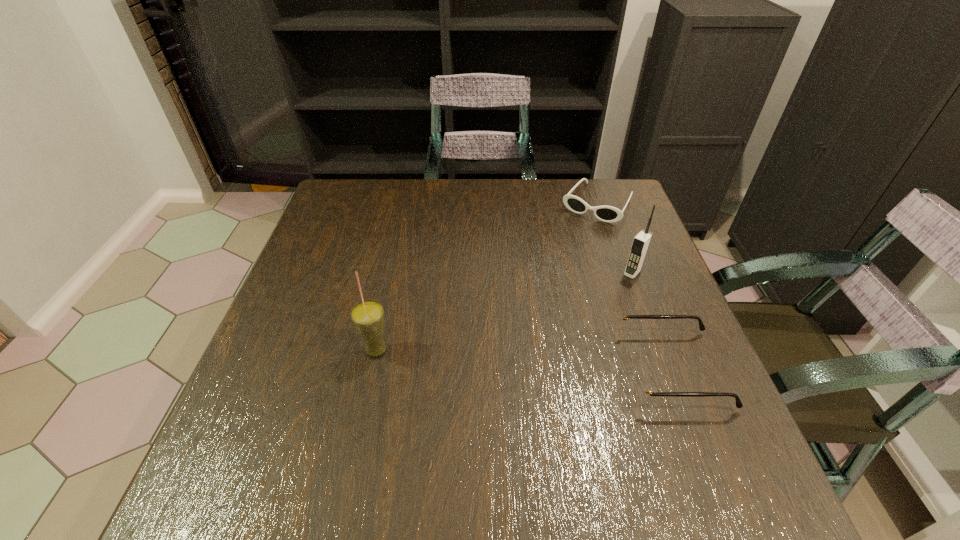
Find the location of a particular element. This screenshot has height=540, width=960. object situated at the near right corner is located at coordinates (640, 385).

Find the location of `vacant region at the far edge`. vacant region at the far edge is located at coordinates (448, 199).

Where is `free space at the near edge`? free space at the near edge is located at coordinates (504, 434).

Identify the location of free spot at the left edge of the desktop. This screenshot has width=960, height=540. (292, 322).

Where is `vacant region at the right edge of the desktop`? This screenshot has height=540, width=960. vacant region at the right edge of the desktop is located at coordinates (599, 258).

In the image, there is a desktop. Identify the location of vacant space at the far left corner. (364, 212).

In the image, there is a desktop. Find the location of `free space at the near left corner`. free space at the near left corner is located at coordinates 314,435.

Where is `blank area at the far right corner`? The width and height of the screenshot is (960, 540). blank area at the far right corner is located at coordinates (621, 195).

This screenshot has width=960, height=540. Identify the location of vacant area at the near right corner of the desktop. (654, 439).

The height and width of the screenshot is (540, 960). I want to click on vacant space that's between the spectacles and the cellular telephone, so click(652, 321).